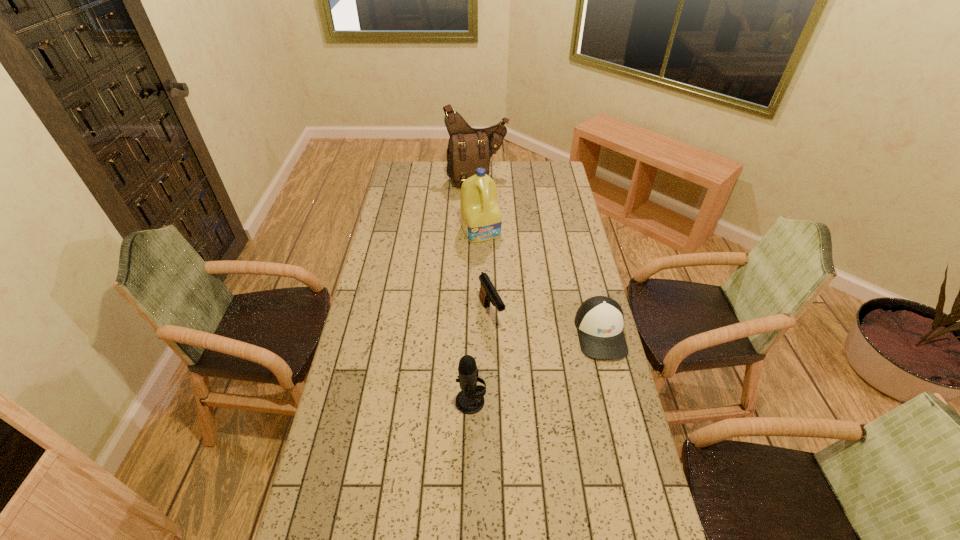
This screenshot has width=960, height=540. Find the location of `free space on the desktop that is between the nearest object and the shortest object and is positioned on the label of the second tallest object`. free space on the desktop that is between the nearest object and the shortest object and is positioned on the label of the second tallest object is located at coordinates (552, 359).

Find the location of `vacant space on the desktop that is between the third tallest object and the cap and is positioned at the barrel of the second shortest object`. vacant space on the desktop that is between the third tallest object and the cap and is positioned at the barrel of the second shortest object is located at coordinates (523, 374).

Locate an element on the screen. vacant space on the desktop that is between the microphone and the cap and is positioned on the front-facing side of the shoulder bag is located at coordinates (558, 355).